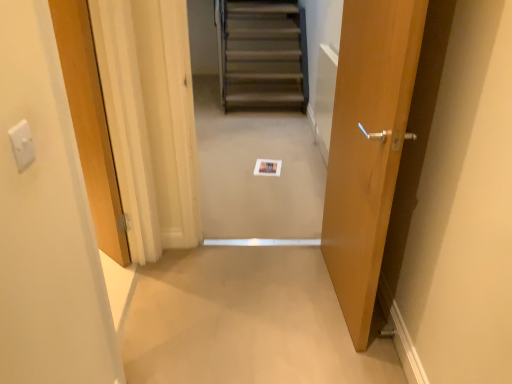
Question: From a real-world perspective, is matte wood door at right, which is the 2th door in left-to-right order, under wooden stairs at center?

Choices:
 (A) no
 (B) yes

Answer: (A)

Question: Is matte wood door at right, the 1th door in the right-to-left sequence, facing towards wooden stairs at center?

Choices:
 (A) yes
 (B) no

Answer: (A)

Question: Is wooden stairs at center located within matte wood door at right, which is the 2th door in left-to-right order?

Choices:
 (A) yes
 (B) no

Answer: (B)

Question: Can you confirm if matte wood door at right, the 1th door in the right-to-left sequence, is bigger than wooden stairs at center?

Choices:
 (A) no
 (B) yes

Answer: (B)

Question: From the image's perspective, would you say matte wood door at right, which is the 2th door in left-to-right order, is positioned over wooden stairs at center?

Choices:
 (A) no
 (B) yes

Answer: (A)

Question: From a real-world perspective, is beige carpet at center physically located above or below matte wood door at right, the 1th door in the right-to-left sequence?

Choices:
 (A) above
 (B) below

Answer: (B)

Question: In the image, is beige carpet at center on the left side or the right side of matte wood door at right, the 1th door in the right-to-left sequence?

Choices:
 (A) right
 (B) left

Answer: (B)

Question: Is point (368, 357) positioned closer to the camera than point (382, 243)?

Choices:
 (A) farther
 (B) closer

Answer: (B)

Question: Considering the positions of beige carpet at center and matte wood door at right, which is the 2th door in left-to-right order, in the image, is beige carpet at center bigger or smaller than matte wood door at right, which is the 2th door in left-to-right order,?

Choices:
 (A) small
 (B) big

Answer: (A)

Question: Looking at their shapes, would you say wooden door at center, which ranks as the first door in left-to-right order, is wider or thinner than white plastic electric outlet at upper left?

Choices:
 (A) wide
 (B) thin

Answer: (A)

Question: Considering the relative positions of wooden door at center, marked as the 2th door in a right-to-left arrangement, and white plastic electric outlet at upper left in the image provided, is wooden door at center, marked as the 2th door in a right-to-left arrangement, to the left or to the right of white plastic electric outlet at upper left?

Choices:
 (A) right
 (B) left

Answer: (B)

Question: From their relative heights in the image, would you say wooden door at center, marked as the 2th door in a right-to-left arrangement, is taller or shorter than white plastic electric outlet at upper left?

Choices:
 (A) tall
 (B) short

Answer: (A)

Question: From a real-world perspective, is wooden door at center, marked as the 2th door in a right-to-left arrangement, physically located above or below white plastic electric outlet at upper left?

Choices:
 (A) below
 (B) above

Answer: (A)

Question: In terms of height, does matte wood door at right, which is the 2th door in left-to-right order, look taller or shorter compared to wooden door at center, which ranks as the first door in left-to-right order?

Choices:
 (A) tall
 (B) short

Answer: (B)

Question: Considering the relative positions of matte wood door at right, which is the 2th door in left-to-right order, and wooden door at center, which ranks as the first door in left-to-right order, in the image provided, is matte wood door at right, which is the 2th door in left-to-right order, to the left or to the right of wooden door at center, which ranks as the first door in left-to-right order,?

Choices:
 (A) right
 (B) left

Answer: (A)